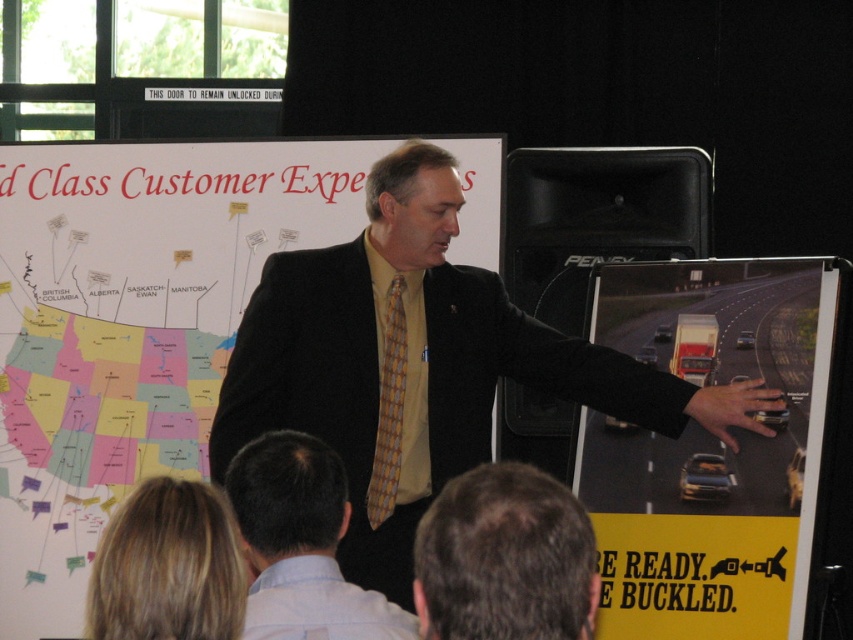
You are organizing a presentation and need to place a decorative ribbon along the edge of the yellow paper at center and the light blue cotton dress shirt at lower left. Which object requires a longer ribbon to cover its width?

The yellow paper at center requires a longer ribbon because its width surpasses that of the light blue cotton dress shirt at lower left.

You are a fashion designer who needs to create a new outfit. You see the matte black suit at center and the light blue cotton dress shirt at lower left in the presentation. What is the minimum distance you need to maintain between these two items to ensure they are not overlapping?

The matte black suit at center is 1.15 meters from the light blue cotton dress shirt at lower left, so the minimum distance to maintain between them to prevent overlapping is 1.15 meters.

From the picture: You are organizing a presentation and need to place the yellow paper at center and the light blue cotton dress shirt at lower left on a table. If the table has limited space, which item should you prioritize placing first to ensure both fit?

The yellow paper at center is bigger than the light blue cotton dress shirt at lower left, so you should prioritize placing the yellow paper at center first to ensure both fit on the table.